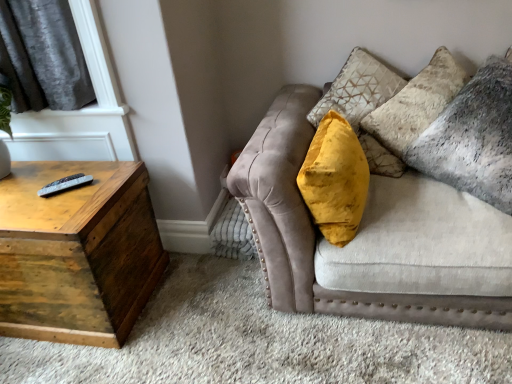
What are the coordinates of `spots to the right of black plastic remote at left` in the screenshot? It's located at (100, 188).